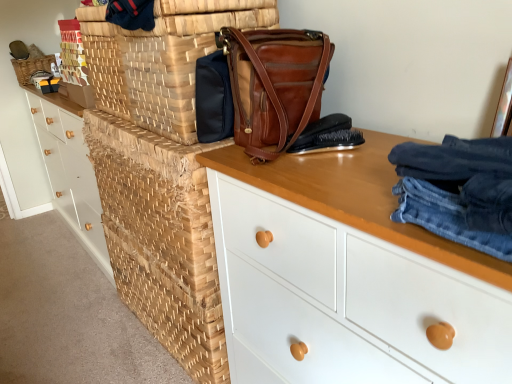
Question: Can you confirm if brown woven basket at center, the 1th basket when ordered from right to left, is taller than woven wood basket at center?

Choices:
 (A) no
 (B) yes

Answer: (A)

Question: Is brown woven basket at center, the 1th basket positioned from the bottom, bigger than woven wood basket at center?

Choices:
 (A) yes
 (B) no

Answer: (B)

Question: Could woven wood basket at center be considered to be inside brown woven basket at center, arranged as the first basket when viewed from the front?

Choices:
 (A) yes
 (B) no

Answer: (B)

Question: Is brown woven basket at center, the 1th basket when ordered from right to left, positioned beyond the bounds of woven wood basket at center?

Choices:
 (A) no
 (B) yes

Answer: (B)

Question: Can you confirm if brown woven basket at center, marked as the 2th basket in a left-to-right arrangement, is thinner than woven wood basket at center?

Choices:
 (A) yes
 (B) no

Answer: (A)

Question: From the image's perspective, is white matte chest of drawers at center, positioned as the first chest of drawers in front-to-back order, located above or below brown woven basket at center, marked as the 2th basket in a left-to-right arrangement?

Choices:
 (A) below
 (B) above

Answer: (A)

Question: In the image, is white matte chest of drawers at center, positioned as the first chest of drawers in front-to-back order, on the left side or the right side of brown woven basket at center, arranged as the first basket when viewed from the front?

Choices:
 (A) left
 (B) right

Answer: (B)

Question: Is white matte chest of drawers at center, positioned as the first chest of drawers in front-to-back order, taller or shorter than brown woven basket at center, the 1th basket positioned from the bottom?

Choices:
 (A) tall
 (B) short

Answer: (A)

Question: Would you say white matte chest of drawers at center, which is the 2th chest of drawers from left to right, is inside or outside brown woven basket at center, the 1th basket positioned from the bottom?

Choices:
 (A) inside
 (B) outside

Answer: (B)

Question: Is brown leather brush at center inside the boundaries of white matte chest of drawers at center, which appears as the first chest of drawers when viewed from the right, or outside?

Choices:
 (A) outside
 (B) inside

Answer: (A)

Question: Does point (302, 144) appear closer or farther from the camera than point (441, 294)?

Choices:
 (A) farther
 (B) closer

Answer: (A)

Question: In terms of size, does brown leather brush at center appear bigger or smaller than white matte chest of drawers at center, which is counted as the 2th chest of drawers, starting from the back?

Choices:
 (A) small
 (B) big

Answer: (A)

Question: In the image, is brown leather brush at center positioned in front of or behind white matte chest of drawers at center, which is the 2th chest of drawers from left to right?

Choices:
 (A) front
 (B) behind

Answer: (B)

Question: Would you say natural woven basket at upper left, the first basket in the top-to-bottom sequence, is to the left or to the right of woven wood chest of drawers at left, the 1th chest of drawers in the back-to-front sequence, in the picture?

Choices:
 (A) left
 (B) right

Answer: (A)

Question: From the image's perspective, relative to woven wood chest of drawers at left, marked as the first chest of drawers in a left-to-right arrangement, is natural woven basket at upper left, positioned as the first basket in left-to-right order, above or below?

Choices:
 (A) below
 (B) above

Answer: (B)